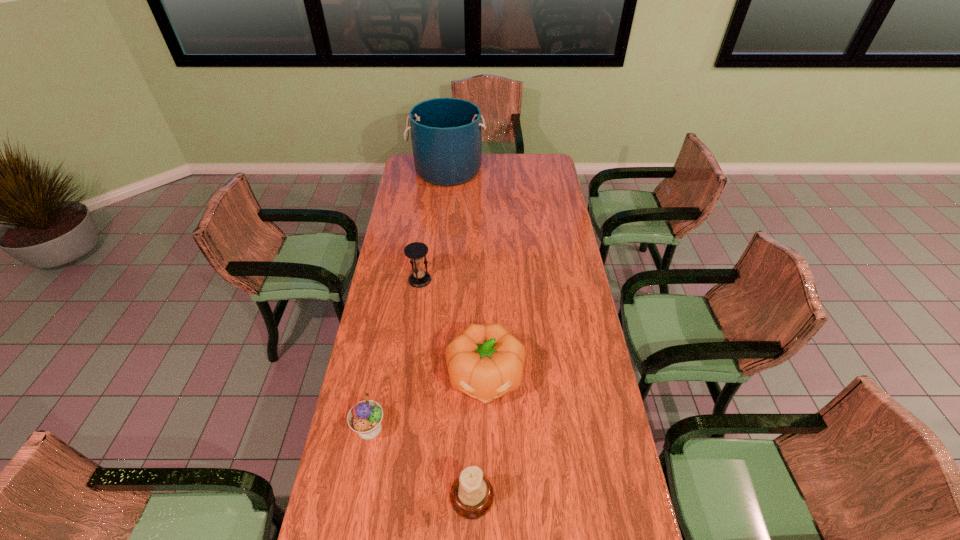
Where is `blank space located 0.310m on the back of the shortest object`? blank space located 0.310m on the back of the shortest object is located at coordinates (387, 336).

Locate an element on the screen. object present at the far edge is located at coordinates (446, 137).

Where is `bucket situated at the left edge`? bucket situated at the left edge is located at coordinates (446, 137).

Find the location of a particular element. This screenshot has height=540, width=960. hourglass that is at the left edge is located at coordinates (415, 251).

Where is `icecream that is at the left edge`? icecream that is at the left edge is located at coordinates (365, 417).

Locate an element on the screen. Image resolution: width=960 pixels, height=540 pixels. object present at the far left corner is located at coordinates (446, 137).

I want to click on free space at the left edge of the desktop, so click(x=370, y=312).

This screenshot has height=540, width=960. I want to click on vacant space at the right edge, so click(552, 223).

This screenshot has width=960, height=540. In the image, there is a desktop. What are the coordinates of `vacant space at the far left corner` in the screenshot? It's located at (410, 157).

The width and height of the screenshot is (960, 540). What are the coordinates of `free region at the far right corner` in the screenshot? It's located at (533, 167).